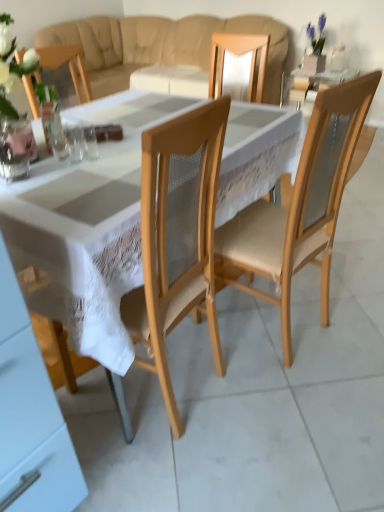
The width and height of the screenshot is (384, 512). What are the coordinates of `white lace tablecloth at center` in the screenshot? It's located at (87, 232).

In order to face clear glass cup at center, the third tableware positioned from the left, should I rotate leftwards or rightwards?

A 13.545 degree turn to the left will do.

Identify the location of clear glass at center, marked as the 2th tableware in a left-to-right arrangement. The image size is (384, 512). (75, 143).

What are the coordinates of `white lace tablecloth at center` in the screenshot? It's located at (87, 232).

Is beige fabric couch at upper center directly adjacent to clear glass at center, marked as the 2th tableware in a left-to-right arrangement?

beige fabric couch at upper center and clear glass at center, marked as the 2th tableware in a left-to-right arrangement, are clearly separated.

Is beige fabric couch at upper center wider or thinner than clear glass at center, which ranks as the 2th tableware in right-to-left order?

Considering their sizes, beige fabric couch at upper center looks broader than clear glass at center, which ranks as the 2th tableware in right-to-left order.

Identify the location of tableware that is the 3rd object located below the beige fabric couch at upper center (from the image's perspective). This screenshot has width=384, height=512. (75, 143).

From the image's perspective, does beige fabric couch at upper center appear higher than clear glass at center, marked as the 2th tableware in a left-to-right arrangement?

Correct, beige fabric couch at upper center appears higher than clear glass at center, marked as the 2th tableware in a left-to-right arrangement, in the image.

How different are the orientations of beige fabric couch at upper center and clear glass cup at center, positioned as the 1th tableware in right-to-left order, in degrees?

77.9 degrees separate the facing orientations of beige fabric couch at upper center and clear glass cup at center, positioned as the 1th tableware in right-to-left order.

Can you confirm if beige fabric couch at upper center is positioned to the right of clear glass cup at center, positioned as the 1th tableware in right-to-left order?

Incorrect, beige fabric couch at upper center is not on the right side of clear glass cup at center, positioned as the 1th tableware in right-to-left order.

Which is behind, point (153, 34) or point (82, 139)?

Positioned behind is point (153, 34).

There is a beige fabric couch at upper center. Identify the location of the 2nd tableware above it (from a real-world perspective). (89, 143).

Are white lace tablecloth at center and clear glass at center, which ranks as the 2th tableware in right-to-left order, beside each other?

white lace tablecloth at center and clear glass at center, which ranks as the 2th tableware in right-to-left order, are not in contact.

Can you confirm if white lace tablecloth at center is shorter than clear glass at center, marked as the 2th tableware in a left-to-right arrangement?

In fact, white lace tablecloth at center may be taller than clear glass at center, marked as the 2th tableware in a left-to-right arrangement.

Could you tell me if white lace tablecloth at center is facing clear glass at center, marked as the 2th tableware in a left-to-right arrangement?

No, white lace tablecloth at center is not turned towards clear glass at center, marked as the 2th tableware in a left-to-right arrangement.

Is clear glass at center, marked as the 2th tableware in a left-to-right arrangement, to the left of beige fabric couch at upper center from the viewer's perspective?

No, clear glass at center, marked as the 2th tableware in a left-to-right arrangement, is not to the left of beige fabric couch at upper center.

From a real-world perspective, is clear glass at center, which ranks as the 2th tableware in right-to-left order, physically above beige fabric couch at upper center?

Yes, from a real-world perspective, clear glass at center, which ranks as the 2th tableware in right-to-left order, is over beige fabric couch at upper center

Is clear glass at center, marked as the 2th tableware in a left-to-right arrangement, aimed at beige fabric couch at upper center?

No, clear glass at center, marked as the 2th tableware in a left-to-right arrangement, is not aimed at beige fabric couch at upper center.

Identify the location of chair lying on the right of white glossy cabinet at lower left. (299, 207).

Considering the relative sizes of natural wood chair at center and white glossy cabinet at lower left in the image provided, is natural wood chair at center bigger than white glossy cabinet at lower left?

Indeed, natural wood chair at center has a larger size compared to white glossy cabinet at lower left.

Can you tell me how much natural wood chair at center and white glossy cabinet at lower left differ in facing direction?

There is a 174-degree angle between the facing directions of natural wood chair at center and white glossy cabinet at lower left.

Consider the image. Does beige fabric couch at upper center contain natural wood chair at center?

No, natural wood chair at center is located outside of beige fabric couch at upper center.

Considering the positions of point (273, 27) and point (312, 180), is point (273, 27) closer or farther from the camera than point (312, 180)?

Point (273, 27).

What's the angular difference between beige fabric couch at upper center and natural wood chair at center's facing directions?

96.5 degrees.

Are beige fabric couch at upper center and natural wood chair at center beside each other?

No, beige fabric couch at upper center is not next to natural wood chair at center.

Is clear glass at center, which is counted as the third tableware, starting from the right, at the back of clear glass at center, marked as the 2th tableware in a left-to-right arrangement?

Yes.

Is clear glass at center, marked as the 2th tableware in a left-to-right arrangement, further to the viewer compared to clear glass at center, which is counted as the third tableware, starting from the right?

No, clear glass at center, marked as the 2th tableware in a left-to-right arrangement, is closer to the viewer.

Which of these two, clear glass at center, which ranks as the 2th tableware in right-to-left order, or clear glass at center, which is counted as the third tableware, starting from the right, is smaller?

clear glass at center, which is counted as the third tableware, starting from the right.

How different are the orientations of clear glass at center, which ranks as the 2th tableware in right-to-left order, and clear glass at center, which is counted as the third tableware, starting from the right, in degrees?

They differ by 0.00013 degrees in their facing directions.

Find the location of a particular element. studio couch located underneath the clear glass at center, marked as the 2th tableware in a left-to-right arrangement (from a real-world perspective) is located at coordinates (161, 46).

Find the location of a particular element. the 2nd tableware to the right of the beige fabric couch at upper center, counting from the anchor's position is located at coordinates click(x=89, y=143).

Looking at the image, which one is located further to clear glass cup at center, the third tableware positioned from the left, beige fabric couch at upper center or clear glass at center, which ranks as the 2th tableware in right-to-left order?

beige fabric couch at upper center lies further to clear glass cup at center, the third tableware positioned from the left, than the other object.

Which object lies further to the anchor point white lace tablecloth at center, white glossy cabinet at lower left or clear glass cup at center, positioned as the 1th tableware in right-to-left order?

white glossy cabinet at lower left is further to white lace tablecloth at center.

Which object lies further to the anchor point natural wood chair at center, white glossy cabinet at lower left or clear glass at center, which is counted as the third tableware, starting from the right?

Among the two, white glossy cabinet at lower left is located further to natural wood chair at center.

When comparing their distances from clear glass vase at lower left, does clear glass at center, which is counted as the third tableware, starting from the right, or white lace tablecloth at center seem closer?

Among the two, clear glass at center, which is counted as the third tableware, starting from the right, is located nearer to clear glass vase at lower left.

Looking at the image, which one is located closer to clear glass cup at center, the third tableware positioned from the left, clear glass at center, which is counted as the third tableware, starting from the right, or clear glass at center, which ranks as the 2th tableware in right-to-left order?

clear glass at center, which ranks as the 2th tableware in right-to-left order.

Based on their spatial positions, is white glossy cabinet at lower left or clear glass at center, the 1th tableware from the left, further from white lace tablecloth at center?

Among the two, white glossy cabinet at lower left is located further to white lace tablecloth at center.

Considering their positions, is clear glass cup at center, positioned as the 1th tableware in right-to-left order, positioned further to clear glass at center, the 1th tableware from the left, than white lace tablecloth at center?

white lace tablecloth at center lies further to clear glass at center, the 1th tableware from the left, than the other object.

When comparing their distances from clear glass cup at center, the third tableware positioned from the left, does clear glass at center, which is counted as the third tableware, starting from the right, or natural wood chair at center seem further?

natural wood chair at center is positioned further to the anchor clear glass cup at center, the third tableware positioned from the left.

Find the location of a particular element. This screenshot has height=512, width=384. cabinetry situated between clear glass at center, which is counted as the third tableware, starting from the right, and natural wood chair at center from left to right is located at coordinates (30, 415).

I want to click on chair between white lace tablecloth at center and beige fabric couch at upper center from front to back, so click(299, 207).

Locate an element on the screen. This screenshot has width=384, height=512. desk between clear glass at center, marked as the 2th tableware in a left-to-right arrangement, and natural wood chair at center, in the horizontal direction is located at coordinates (87, 232).

Locate an element on the screen. vase between white glossy cabinet at lower left and clear glass at center, which is counted as the third tableware, starting from the right, in the front-back direction is located at coordinates (16, 149).